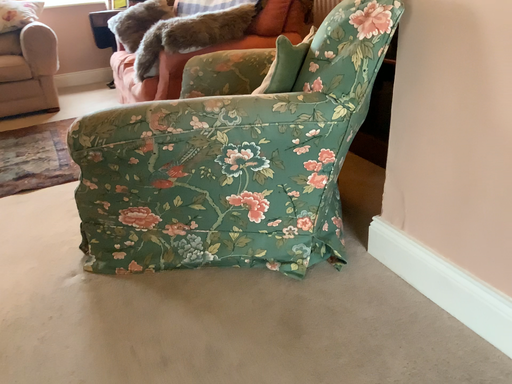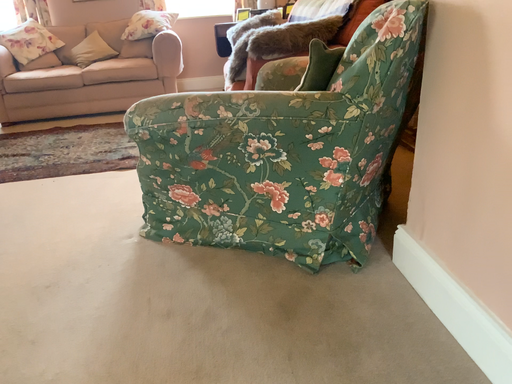
Question: How did the camera likely rotate when shooting the video?

Choices:
 (A) rotated left
 (B) rotated right

Answer: (A)